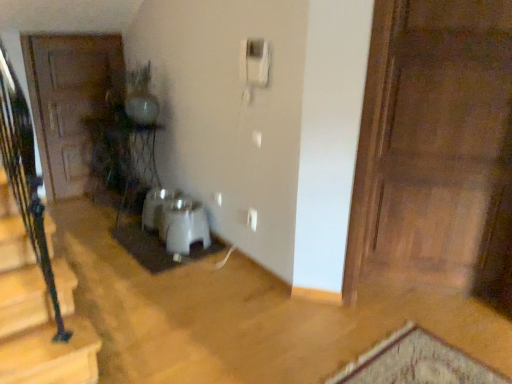
Identify the location of vacant space to the left of white plastic water heater at center. The height and width of the screenshot is (384, 512). (144, 244).